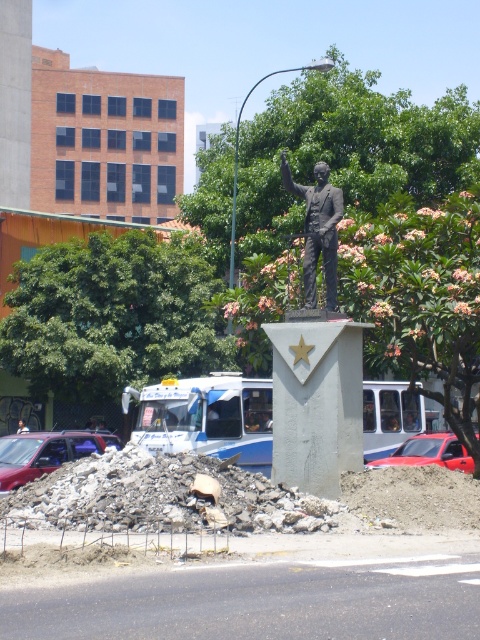
Is point (15, 467) positioned after point (375, 467)?

No, it is not.

Measure the distance between point (98,433) and camera.

Point (98,433) is 24.85 meters from camera.

What are the coordinates of `matte red car at lower left` in the screenshot? It's located at (46, 452).

This screenshot has height=640, width=480. I want to click on matte red car at lower left, so click(46, 452).

This screenshot has width=480, height=640. What do you see at coordinates (46, 452) in the screenshot? I see `matte red car at lower left` at bounding box center [46, 452].

Does matte red car at lower left have a greater width compared to blurred plastic man at center?

Yes.

Where is `matte red car at lower left`? Image resolution: width=480 pixels, height=640 pixels. matte red car at lower left is located at coordinates 46,452.

Who is higher up, rubble concrete at center or bronze statue at center?

Positioned higher is bronze statue at center.

Between point (145, 500) and point (309, 296), which one is positioned behind?

Positioned behind is point (309, 296).

What are the coordinates of `rubble concrete at center` in the screenshot? It's located at (158, 496).